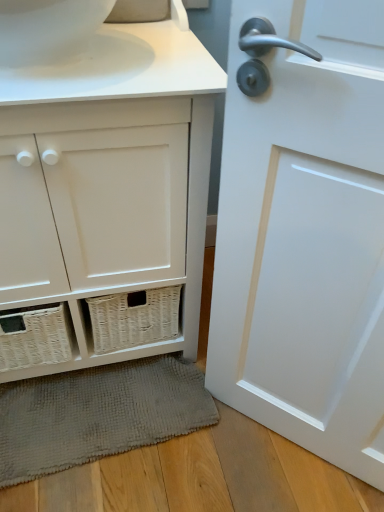
Question: Is the position of white wicker basket at lower left more distant than that of white glossy toilet bowl at upper left?

Choices:
 (A) no
 (B) yes

Answer: (A)

Question: From a real-world perspective, is white wicker basket at lower left beneath white glossy toilet bowl at upper left?

Choices:
 (A) no
 (B) yes

Answer: (B)

Question: Considering the relative sizes of white wicker basket at lower left and white glossy toilet bowl at upper left in the image provided, is white wicker basket at lower left wider than white glossy toilet bowl at upper left?

Choices:
 (A) no
 (B) yes

Answer: (B)

Question: From the image's perspective, would you say white wicker basket at lower left is positioned over white glossy toilet bowl at upper left?

Choices:
 (A) no
 (B) yes

Answer: (A)

Question: Is white wicker basket at lower left directly adjacent to white glossy toilet bowl at upper left?

Choices:
 (A) no
 (B) yes

Answer: (A)

Question: Is white glossy toilet bowl at upper left taller or shorter than white wicker basket at lower left?

Choices:
 (A) tall
 (B) short

Answer: (B)

Question: Relative to white wicker basket at lower left, is white glossy toilet bowl at upper left in front or behind?

Choices:
 (A) behind
 (B) front

Answer: (A)

Question: From a real-world perspective, relative to white wicker basket at lower left, is white glossy toilet bowl at upper left vertically above or below?

Choices:
 (A) below
 (B) above

Answer: (B)

Question: In terms of width, does white glossy toilet bowl at upper left look wider or thinner when compared to white wicker basket at lower left?

Choices:
 (A) wide
 (B) thin

Answer: (B)

Question: In the image, is white glossy toilet bowl at upper left positioned in front of or behind gray textured bath mat at lower center?

Choices:
 (A) front
 (B) behind

Answer: (A)

Question: Is white glossy toilet bowl at upper left spatially inside gray textured bath mat at lower center, or outside of it?

Choices:
 (A) inside
 (B) outside

Answer: (B)

Question: Is white glossy toilet bowl at upper left wider or thinner than gray textured bath mat at lower center?

Choices:
 (A) wide
 (B) thin

Answer: (A)

Question: Is point (34, 26) closer or farther from the camera than point (31, 475)?

Choices:
 (A) closer
 (B) farther

Answer: (A)

Question: Is white glossy door at right situated inside gray textured bath mat at lower center or outside?

Choices:
 (A) inside
 (B) outside

Answer: (B)

Question: Considering the relative positions of white glossy door at right and gray textured bath mat at lower center in the image provided, is white glossy door at right to the left or to the right of gray textured bath mat at lower center?

Choices:
 (A) left
 (B) right

Answer: (B)